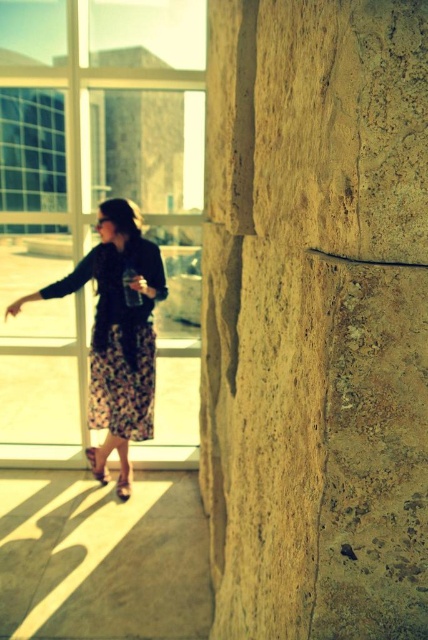
Which is more to the left, transparent glass door at upper left or leather textured sandal at lower center?

transparent glass door at upper left is more to the left.

Does transparent glass door at upper left appear over leather textured sandal at lower center?

Yes.

Which is behind, point (32, 230) or point (127, 481)?

The point (127, 481) is more distant.

You are a GUI agent. You are given a task and a screenshot of the screen. Output one action in this format:
    pyautogui.click(x=<x>, y=<y>)
    Task: Click on the transparent glass door at upper left
    This screenshot has width=428, height=640.
    Given the screenshot: What is the action you would take?
    pyautogui.click(x=95, y=205)

This screenshot has height=640, width=428. Describe the element at coordinates (118, 326) in the screenshot. I see `floral skirt at center` at that location.

Is point (95, 384) positioned after point (127, 477)?

No, it is not.

Image resolution: width=428 pixels, height=640 pixels. I want to click on floral skirt at center, so click(118, 326).

Is transparent glass door at upper left bigger than leather textured sandal at lower left?

Indeed, transparent glass door at upper left has a larger size compared to leather textured sandal at lower left.

Find the location of a particular element. This screenshot has height=640, width=428. transparent glass door at upper left is located at coordinates (95, 205).

Where is `transparent glass door at upper left`? transparent glass door at upper left is located at coordinates (95, 205).